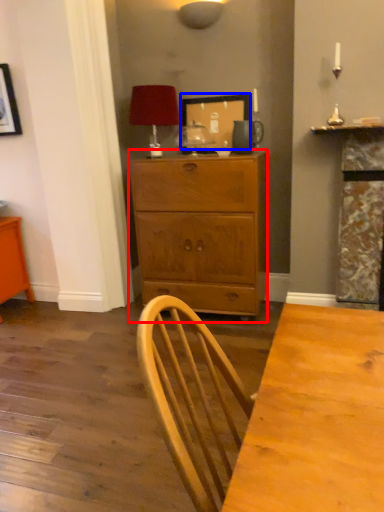
Question: Which object appears farthest to the camera in this image, chest of drawers (highlighted by a red box) or picture frame (highlighted by a blue box)?

Choices:
 (A) chest of drawers
 (B) picture frame

Answer: (B)